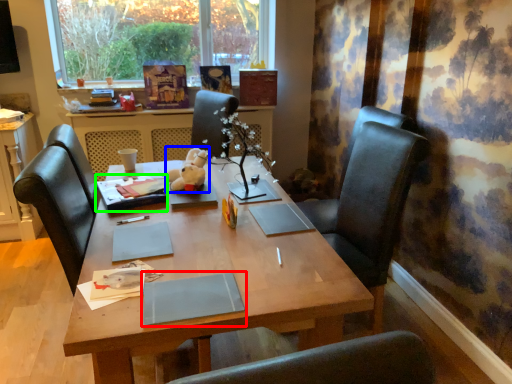
Question: Based on their relative distances, which object is farther from notebook (highlighted by a red box)? Choose from toy (highlighted by a blue box) and book (highlighted by a green box).

Choices:
 (A) toy
 (B) book

Answer: (A)